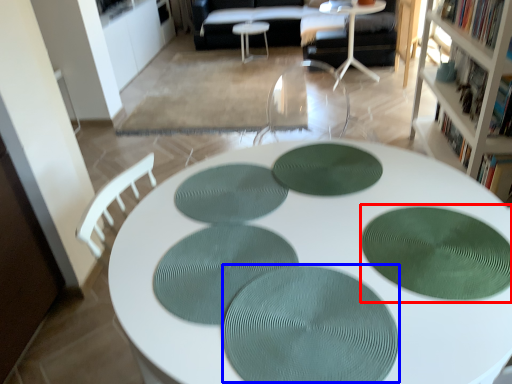
Question: Which object is further to the camera taking this photo, mat (highlighted by a red box) or oval (highlighted by a blue box)?

Choices:
 (A) mat
 (B) oval

Answer: (A)